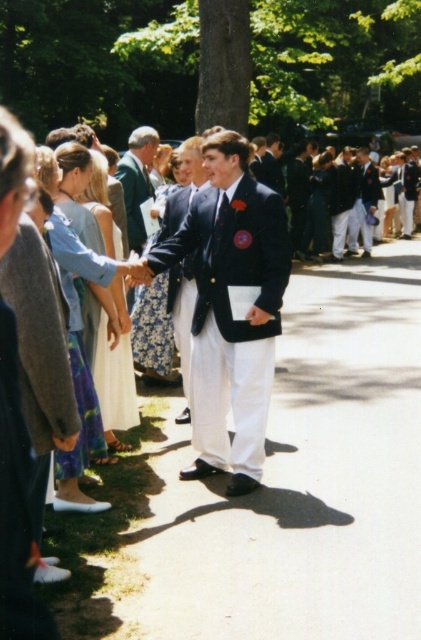
Which is more to the left, shiny navy blazer at center or dark blue blazer at center?

shiny navy blazer at center

Can you confirm if shiny navy blazer at center is thinner than dark blue blazer at center?

No, shiny navy blazer at center is not thinner than dark blue blazer at center.

Identify the location of shiny navy blazer at center. (231, 308).

Can you confirm if shiny navy blazer at center is positioned above green wool blazer at center?

Actually, shiny navy blazer at center is below green wool blazer at center.

Who is higher up, shiny navy blazer at center or green wool blazer at center?

Positioned higher is green wool blazer at center.

Who is more forward, (x=253, y=360) or (x=130, y=225)?

Point (x=253, y=360) is in front.

Locate an element on the screen. The width and height of the screenshot is (421, 640). shiny navy blazer at center is located at coordinates (231, 308).

Between white satin dress at center and dark blue suit at center, which one is positioned higher?

Positioned higher is dark blue suit at center.

Describe the element at coordinates (116, 369) in the screenshot. I see `white satin dress at center` at that location.

Who is more distant from viewer, (127,400) or (295,170)?

Point (295,170)

Where is `white satin dress at center`? white satin dress at center is located at coordinates pyautogui.click(x=116, y=369).